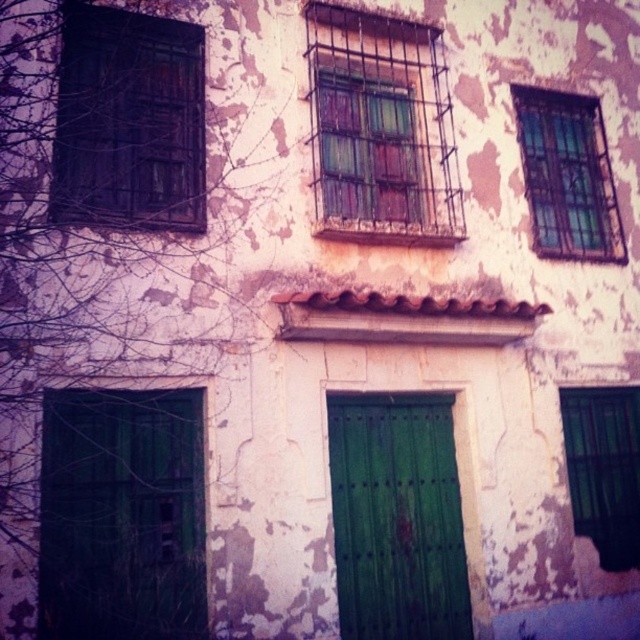
Question: Considering the relative positions of matte metal bars at center and clear glass window at upper right in the image provided, where is matte metal bars at center located with respect to clear glass window at upper right?

Choices:
 (A) above
 (B) below

Answer: (A)

Question: Which point is closer to the camera?

Choices:
 (A) (97, 220)
 (B) (320, 116)
 (C) (419, 515)
 (D) (150, 460)

Answer: (D)

Question: Can you confirm if green matte door at center is positioned to the left of green wooden door at lower left?

Choices:
 (A) yes
 (B) no

Answer: (A)

Question: Considering the relative positions of green matte door at left and dark wood window at upper left in the image provided, where is green matte door at left located with respect to dark wood window at upper left?

Choices:
 (A) above
 (B) below

Answer: (B)

Question: Which of the following is the closest to the observer?

Choices:
 (A) green wooden door at lower left
 (B) dark wood window at upper left
 (C) green matte door at center

Answer: (B)

Question: Which point is closer to the camera taking this photo?

Choices:
 (A) (593, 182)
 (B) (102, 140)

Answer: (B)